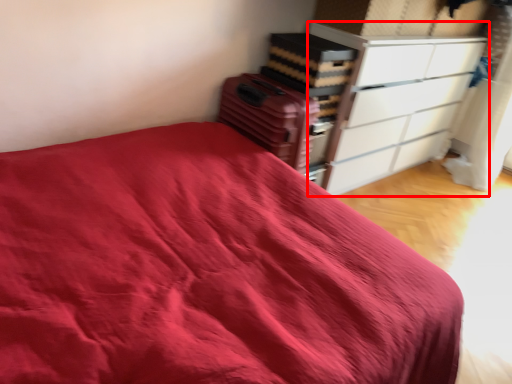
Question: From the image's perspective, considering the relative positions of chest of drawers (annotated by the red box) and luggage in the image provided, where is chest of drawers (annotated by the red box) located with respect to the staircase?

Choices:
 (A) above
 (B) below

Answer: (A)